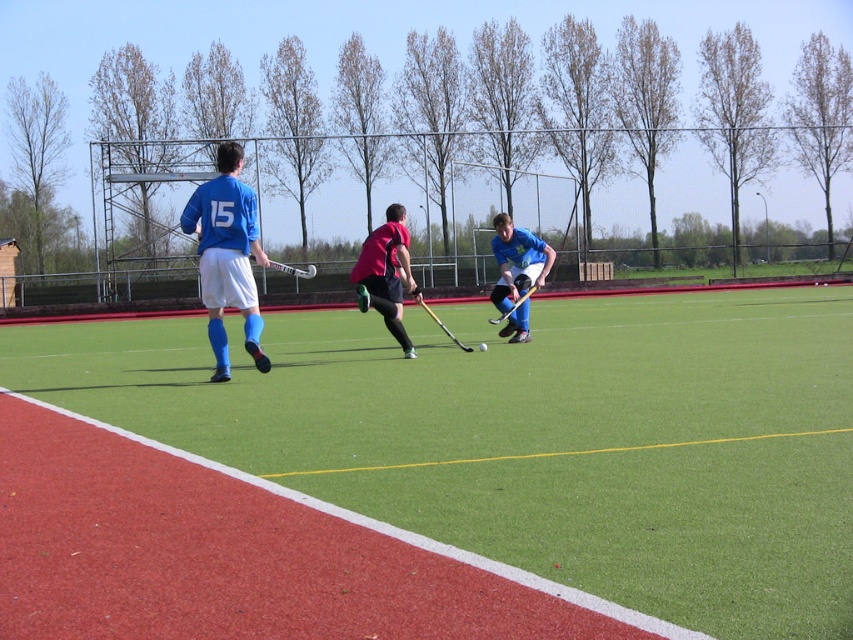
You are a field hockey coach observing the game. You notice the matte blue jersey at center and the wooden hockey stick at center. Based on their positions, which object is closer to the ground?

The wooden hockey stick at center is closer to the ground because the matte blue jersey at center is located above it.

You are a sports analyst watching the field hockey match. You notice the matte blue jersey at center and the wooden hockey stick at center. Which object is taller?

The matte blue jersey at center is taller than the wooden hockey stick at center.